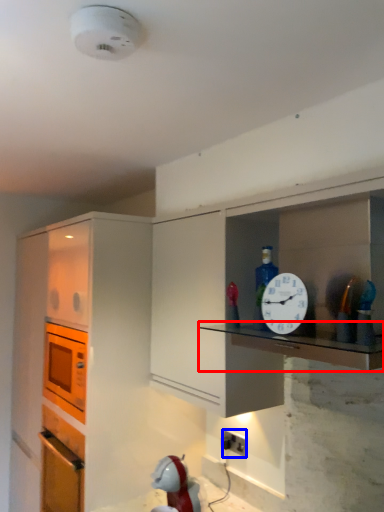
Question: Which of the following is the closest to the observer, counter top (highlighted by a red box) or electric outlet (highlighted by a blue box)?

Choices:
 (A) counter top
 (B) electric outlet

Answer: (A)